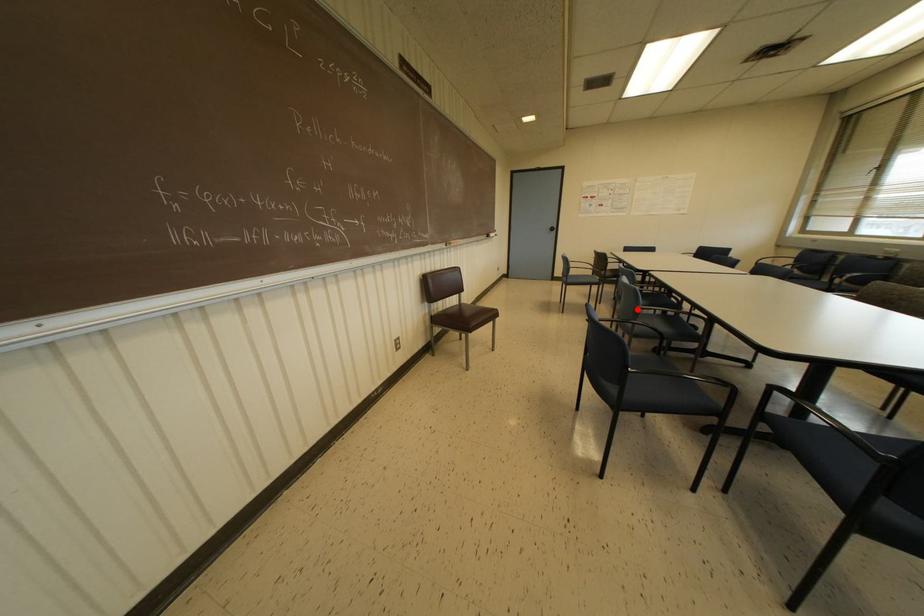
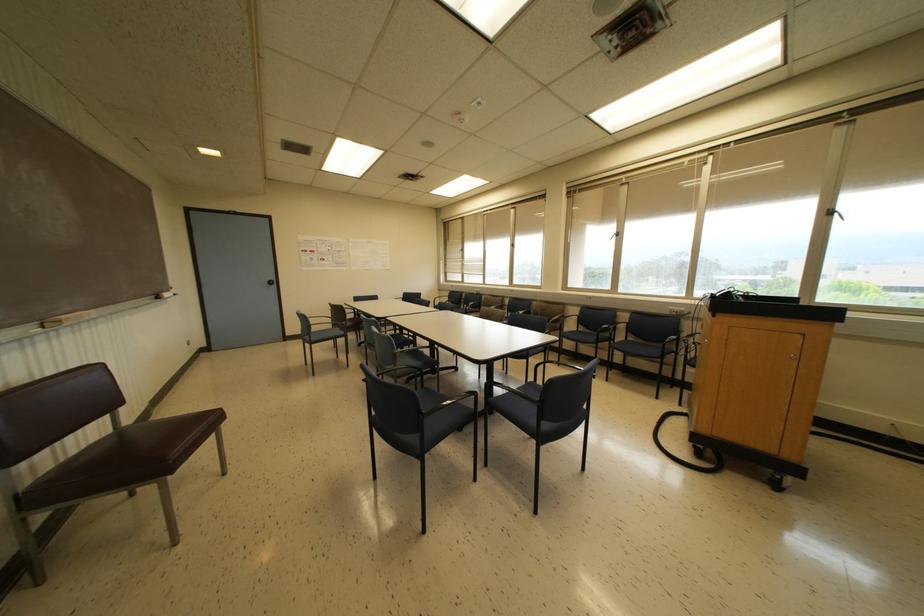
In the second image, find the point that corresponds to the highlighted location in the first image.

(394, 354)